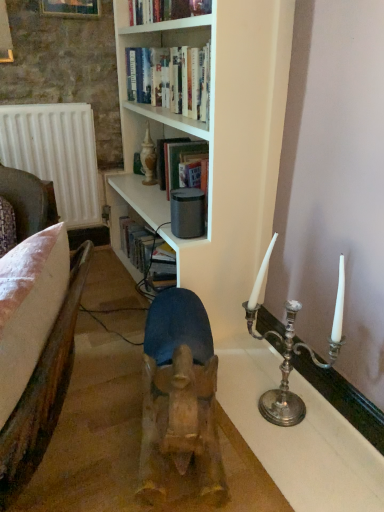
Question: Is white matte radiator at left wider or thinner than brown leather armchair at left?

Choices:
 (A) wide
 (B) thin

Answer: (B)

Question: Based on their sizes in the image, would you say white matte radiator at left is bigger or smaller than brown leather armchair at left?

Choices:
 (A) big
 (B) small

Answer: (B)

Question: Which object is positioned closest to the hardcover book at upper center?

Choices:
 (A) wooden frame at upper left
 (B) white matte radiator at left
 (C) silver metallic candle holder at right
 (D) brown leather armchair at left
 (E) white matte bookshelf at upper center

Answer: (E)

Question: Which object is the closest to the white matte radiator at left?

Choices:
 (A) white matte bookshelf at upper center
 (B) wooden frame at upper left
 (C) brown leather armchair at left
 (D) hardcover book at upper center
 (E) silver metallic candle holder at right

Answer: (A)